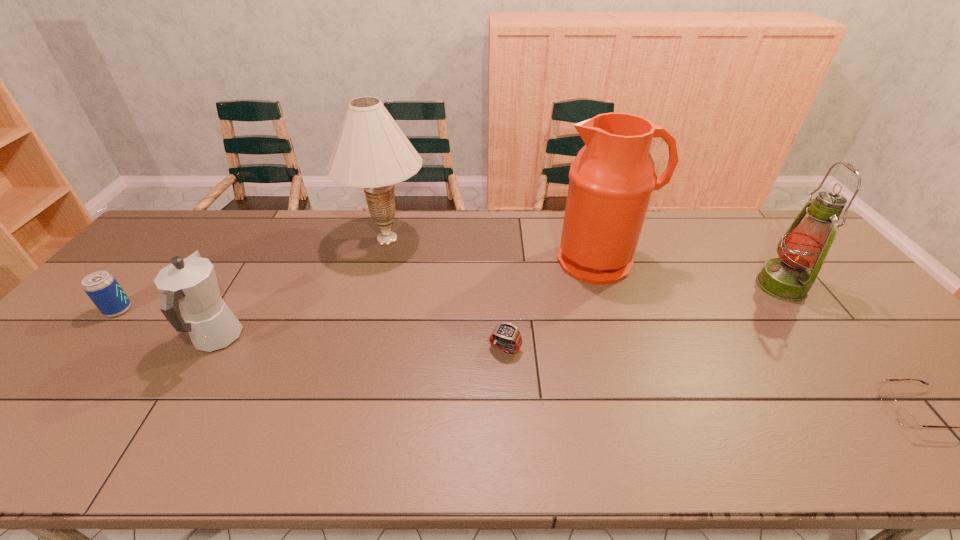
At what (x,y) coordinates should I click in order to perform the action: click on lampshade. Please return your answer as a coordinate pair (x, y). Looking at the image, I should click on (371, 152).

At what (x,y) coordinates should I click in order to perform the action: click on the third object from right to left. Please return your answer as a coordinate pair (x, y). The width and height of the screenshot is (960, 540). Looking at the image, I should click on (612, 178).

Find the location of a particular element. The image size is (960, 540). oil lamp is located at coordinates (805, 245).

You are a GUI agent. You are given a task and a screenshot of the screen. Output one action in this format:
    pyautogui.click(x=<x>, y=<y>)
    Task: Click on the fourth tallest object
    Image resolution: width=960 pixels, height=540 pixels.
    Given the screenshot: What is the action you would take?
    pyautogui.click(x=190, y=286)

Locate an element on the screen. The image size is (960, 540). the sixth object from right to left is located at coordinates (190, 286).

Where is `beer can`? The image size is (960, 540). beer can is located at coordinates (102, 288).

You are a GUI agent. You are given a task and a screenshot of the screen. Output one action in this format:
    pyautogui.click(x=<x>, y=<y>)
    Task: Click on the fifth tallest object
    The width and height of the screenshot is (960, 540).
    Given the screenshot: What is the action you would take?
    pyautogui.click(x=102, y=288)

I want to click on the second shortest object, so click(x=505, y=336).

Locate an element on the screen. watch is located at coordinates (505, 336).

You are a GUI agent. You are given a task and a screenshot of the screen. Output one action in this format:
    pyautogui.click(x=<x>, y=<y>)
    Task: Click on the free space located 0.060m on the right of the third object from left to right
    This screenshot has height=540, width=960.
    Given the screenshot: What is the action you would take?
    pyautogui.click(x=447, y=238)